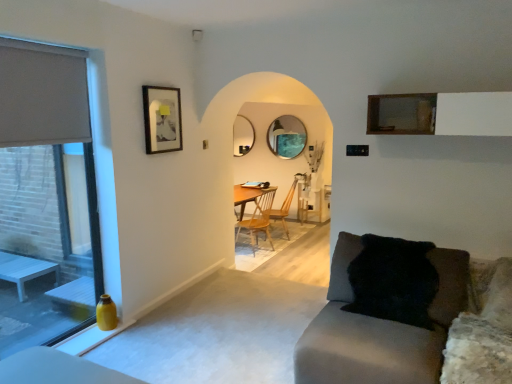
Question: Does point (96, 279) appear closer or farther from the camera than point (162, 134)?

Choices:
 (A) closer
 (B) farther

Answer: (A)

Question: From the image's perspective, is matte glass window at left positioned above or below matte black picture frame at upper left?

Choices:
 (A) above
 (B) below

Answer: (B)

Question: Estimate the real-world distances between objects in this image. Which object is farther from the wooden at center, the second chair in the back-to-front sequence?

Choices:
 (A) matte silver mirror at center, acting as the second mirror starting from the right
 (B) black fur pillow at lower right
 (C) matte gray curtain at left
 (D) matte glass mirror at center, which is the first mirror in right-to-left order
 (E) matte glass window at left

Answer: (C)

Question: Considering the real-world distances, which object is farthest from the matte glass mirror at center, which is the first mirror in right-to-left order?

Choices:
 (A) matte gray curtain at left
 (B) black fur pillow at lower right
 (C) matte glass window at left
 (D) matte silver mirror at center, the 1th mirror from the left
 (E) velvet grey couch at lower right

Answer: (E)